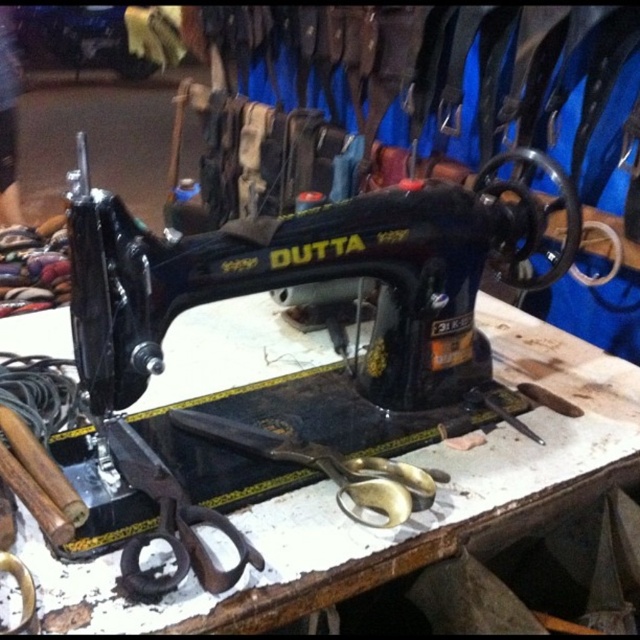
Question: Which point is closer to the camera?

Choices:
 (A) black metal scissors at lower left
 (B) black matte sewing machine at center

Answer: (B)

Question: Which point appears closest to the camera in this image?

Choices:
 (A) (147, 484)
 (B) (257, 438)
 (C) (531, 232)

Answer: (A)

Question: Is black matte sewing machine at center wider than black metal scissors at lower left?

Choices:
 (A) yes
 (B) no

Answer: (A)

Question: Is black matte sewing machine at center positioned before black metal scissors at lower left?

Choices:
 (A) no
 (B) yes

Answer: (B)

Question: Does black matte sewing machine at center appear on the left side of black metal scissors at lower left?

Choices:
 (A) no
 (B) yes

Answer: (A)

Question: Which point is farther to the camera?

Choices:
 (A) gold metallic scissors at center
 (B) black matte sewing machine at center
 (C) black metal scissors at lower left

Answer: (A)